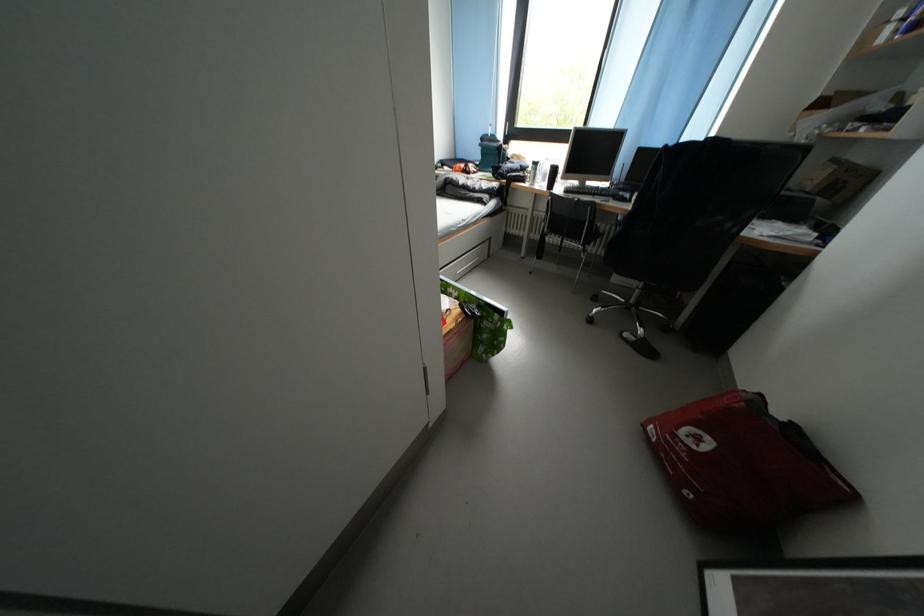
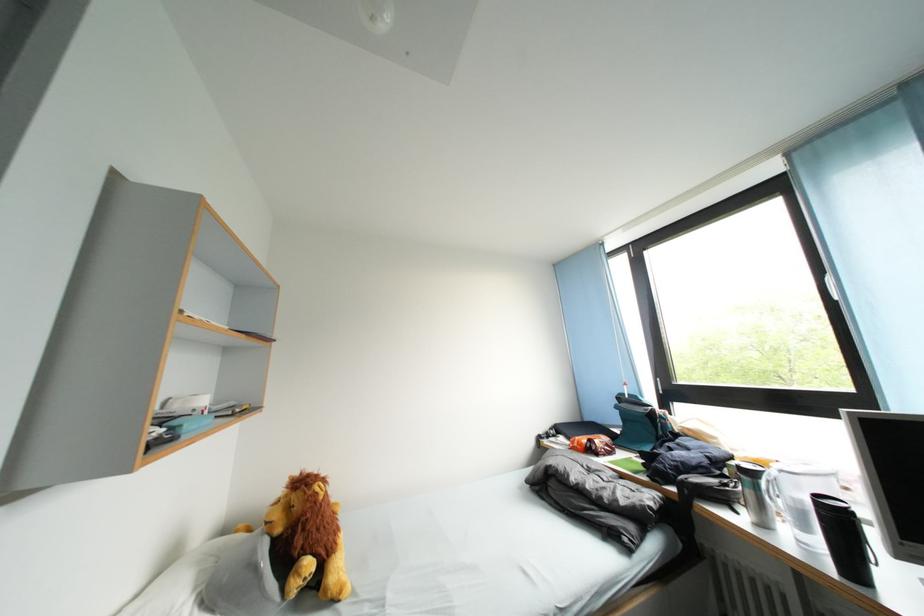
Where in the second image is the point corresponding to the point at 484,192 from the first image?

(614, 501)